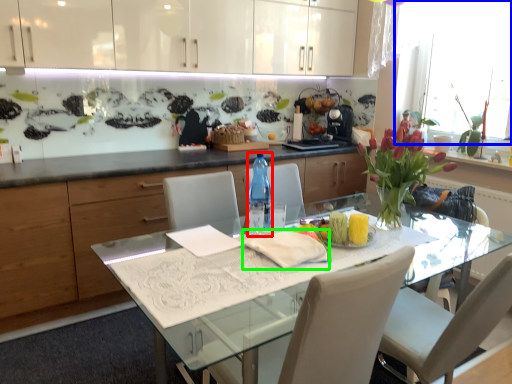
Question: Estimate the real-world distances between objects in this image. Which object is farther from bottle (highlighted by a red box), window screen (highlighted by a blue box) or cloth (highlighted by a green box)?

Choices:
 (A) window screen
 (B) cloth

Answer: (A)